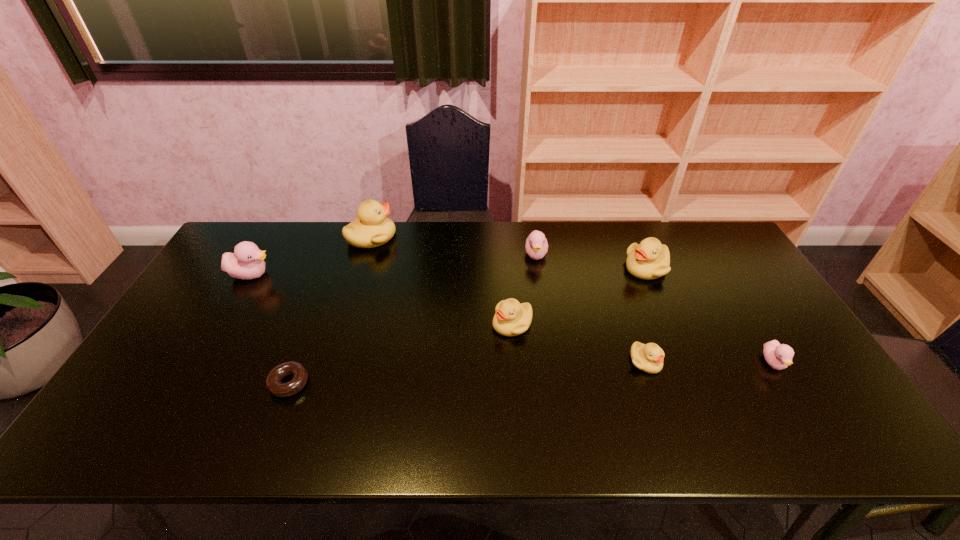
Locate which pink duckling is the second closest to the nearest yellow duckling. Please provide its 2D coordinates. Your answer should be formatted as a tuple, i.e. [(x, y)], where the tuple contains the x and y coordinates of a point satisfying the conditions above.

[(536, 246)]

Where is `free location that satisfies the following two spatial constraints: 1. on the front-facing side of the third biggest yellow duckling; 2. on the front side of the doughnut`? free location that satisfies the following two spatial constraints: 1. on the front-facing side of the third biggest yellow duckling; 2. on the front side of the doughnut is located at coordinates (516, 383).

Where is `free spot that satisfies the following two spatial constraints: 1. on the front-facing side of the biggest pink duckling; 2. on the right side of the brown doughnut`? The height and width of the screenshot is (540, 960). free spot that satisfies the following two spatial constraints: 1. on the front-facing side of the biggest pink duckling; 2. on the right side of the brown doughnut is located at coordinates (189, 383).